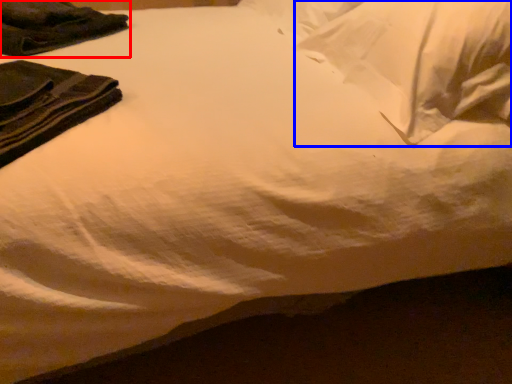
Question: Among these objects, which one is farthest to the camera, clothing (highlighted by a red box) or pillow (highlighted by a blue box)?

Choices:
 (A) clothing
 (B) pillow

Answer: (A)